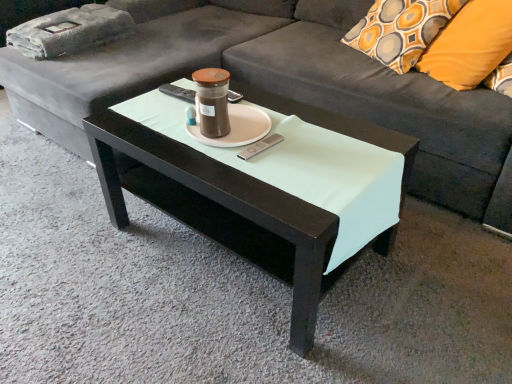
The height and width of the screenshot is (384, 512). Identify the location of vacant space situated above matte black coffee table at center (from a real-world perspective). (253, 137).